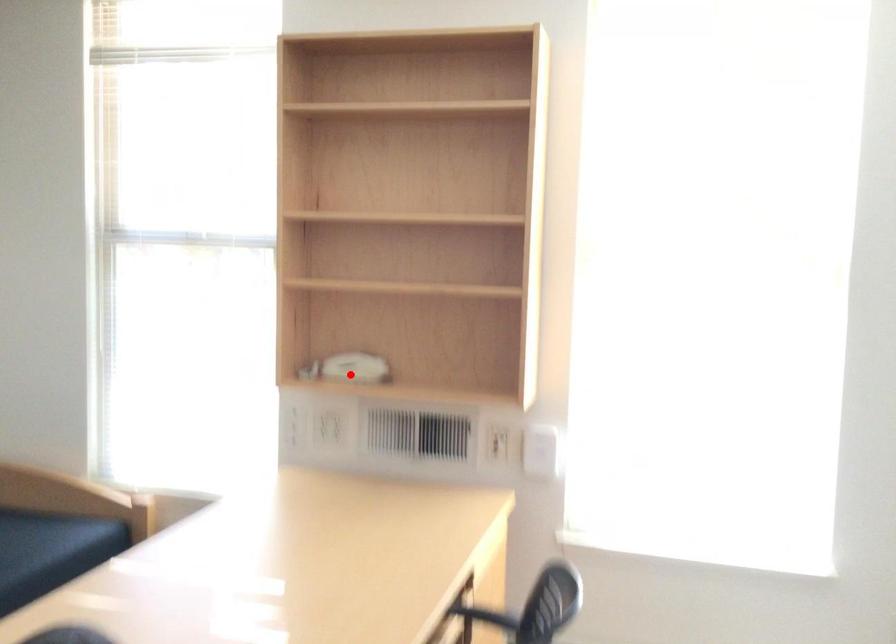
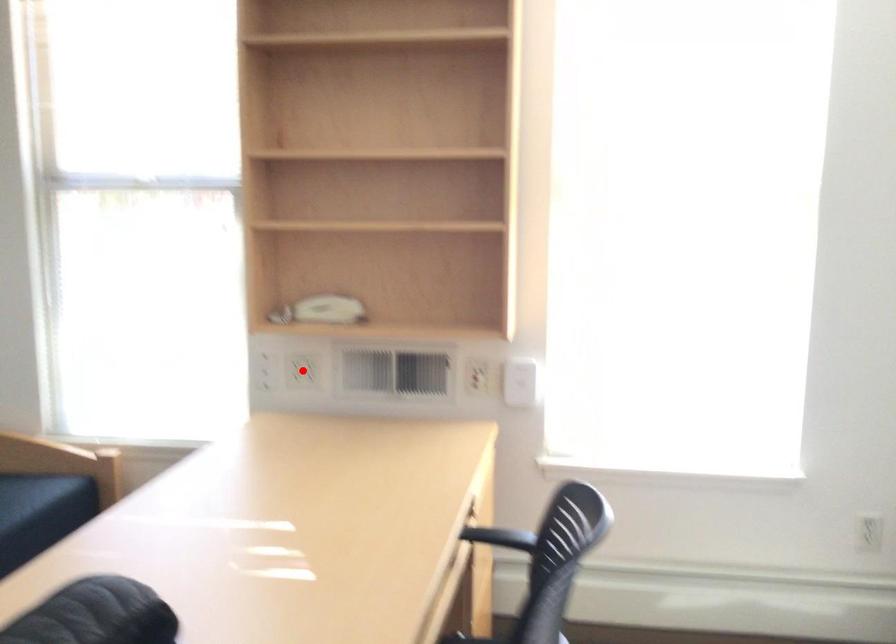
I am providing you with two images of the same scene from different viewpoints. A red point is marked on the first image and another point is marked on the second image. Is the red point in image1 aligned with the point shown in image2?

No